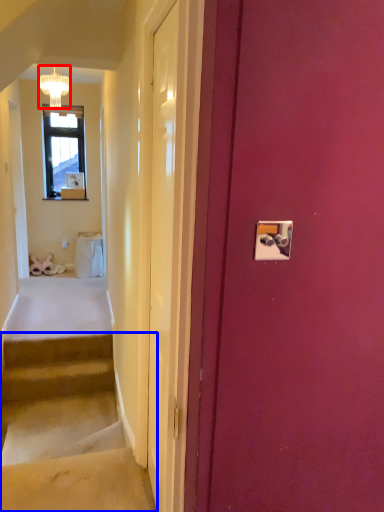
Question: Which of the following is the closest to the observer, lamp (highlighted by a red box) or stairs (highlighted by a blue box)?

Choices:
 (A) lamp
 (B) stairs

Answer: (B)